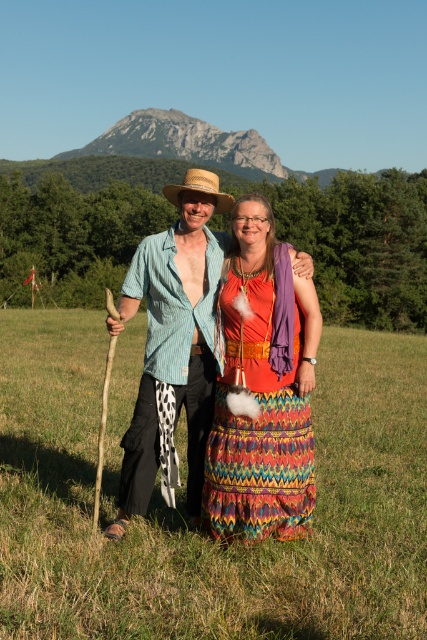
Is striped cotton shirt at center above gray rock formation at upper center?

No.

Which of these two, striped cotton shirt at center or gray rock formation at upper center, stands taller?

Standing taller between the two is gray rock formation at upper center.

Measure the distance between point (192, 212) and camera.

They are 4.51 meters apart.

Image resolution: width=427 pixels, height=640 pixels. Find the location of `striped cotton shirt at center`. striped cotton shirt at center is located at coordinates (173, 344).

What do you see at coordinates (184, 512) in the screenshot?
I see `green grass at center` at bounding box center [184, 512].

Who is more forward, (x=87, y=548) or (x=129, y=454)?

Point (x=87, y=548) is more forward.

Is point (389, 492) positioned in front of point (219, 257)?

No.

Image resolution: width=427 pixels, height=640 pixels. I want to click on green grass at center, so click(184, 512).

Is gray rock formation at upper center positioned in front of strawmaterial/texturecowboy hat at center?

That is False.

Image resolution: width=427 pixels, height=640 pixels. What are the coordinates of `gray rock formation at upper center` in the screenshot? It's located at (187, 144).

The image size is (427, 640). Find the location of `gray rock formation at upper center`. gray rock formation at upper center is located at coordinates point(187,144).